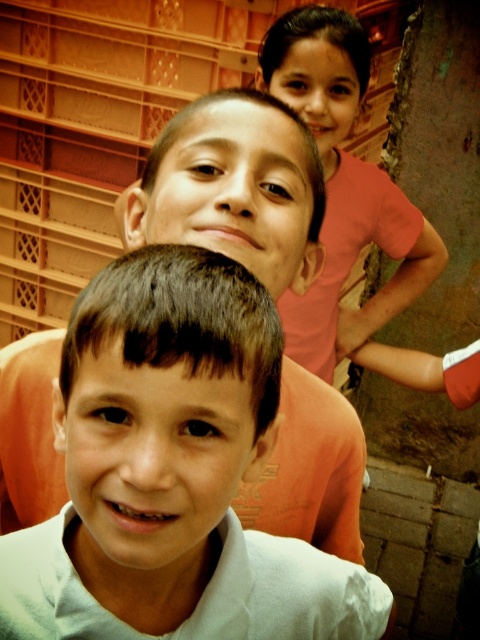
Which is above, light gray cotton shirt at center or pink cotton shirt at upper right?

Positioned higher is pink cotton shirt at upper right.

Does light gray cotton shirt at center appear on the left side of pink cotton shirt at upper right?

Yes, light gray cotton shirt at center is to the left of pink cotton shirt at upper right.

Identify the location of light gray cotton shirt at center. (172, 465).

Find the location of a particular element. Image resolution: width=480 pixels, height=640 pixels. light gray cotton shirt at center is located at coordinates (172, 465).